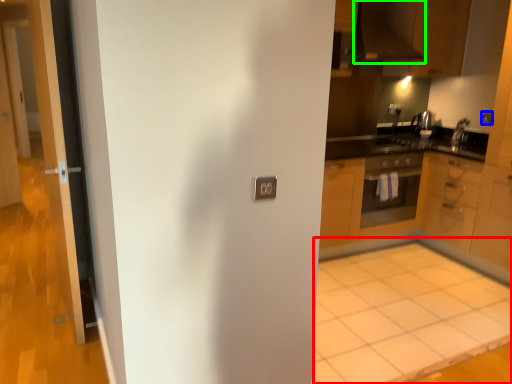
Question: Estimate the real-world distances between objects in this image. Which object is farther from plain (highlighted by a red box), electric outlet (highlighted by a blue box) or exhaust hood (highlighted by a green box)?

Choices:
 (A) electric outlet
 (B) exhaust hood

Answer: (B)